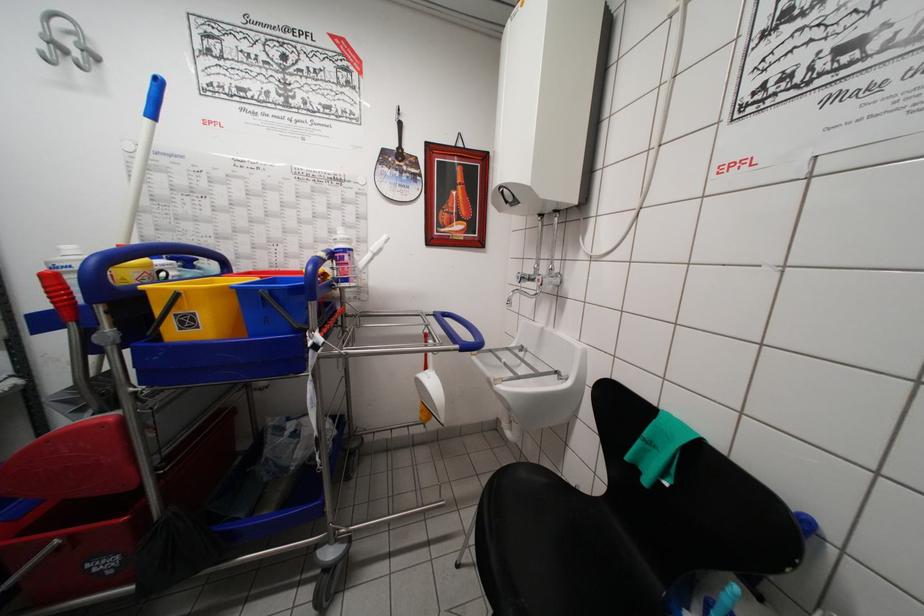
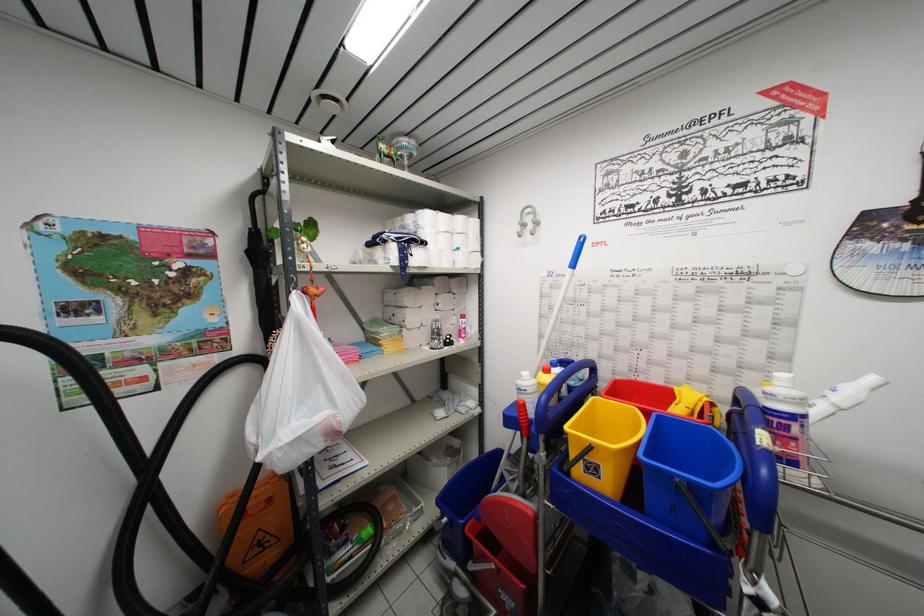
The point at (378, 259) is marked in the first image. Where is the corresponding point in the second image?

(845, 415)